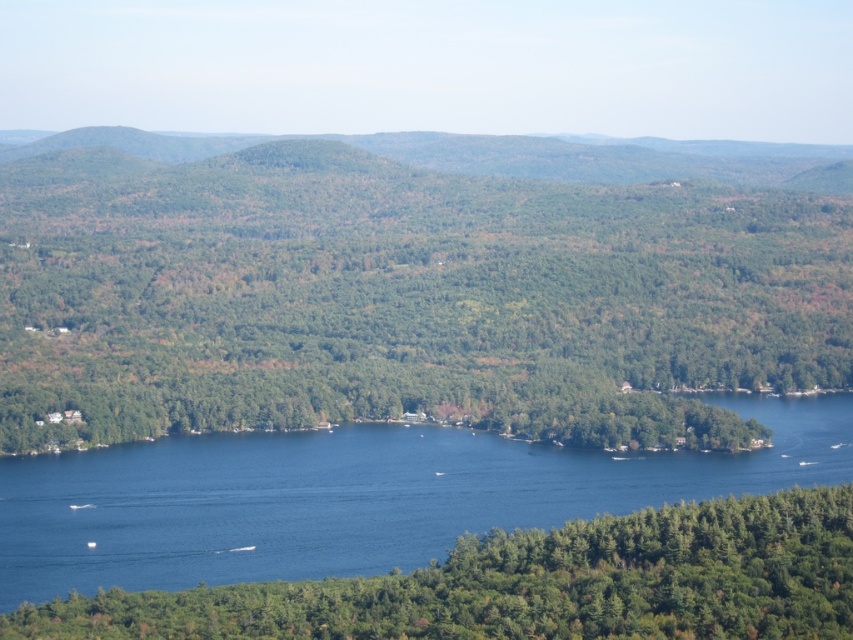
Question: Can you confirm if green matte tree at center is positioned to the left of green matte tree at lower center?

Choices:
 (A) yes
 (B) no

Answer: (A)

Question: Does green matte tree at center appear under green matte tree at lower center?

Choices:
 (A) no
 (B) yes

Answer: (A)

Question: Can you confirm if green matte tree at center is thinner than green matte tree at lower center?

Choices:
 (A) no
 (B) yes

Answer: (A)